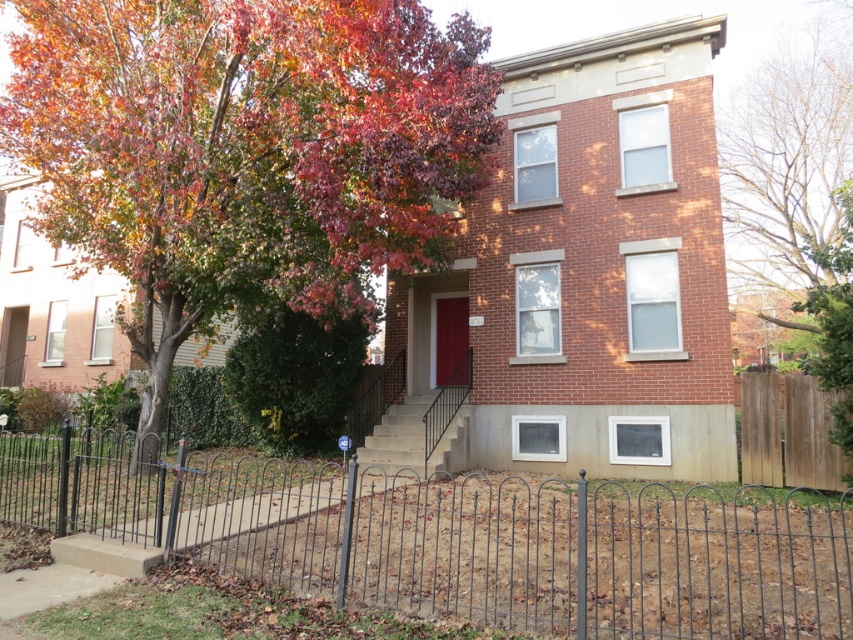
You are standing in front of the house and want to know which of the two points, point (x=381, y=508) or point (x=811, y=240), is closer to you. Which one is closer?

Point (x=381, y=508) is closer to the camera than point (x=811, y=240), so it is closer to you.

You are a gardener who needs to clear autumn leaves at center from the yard. The black wrought iron fence at center is in the way. Can you reach the leaves without moving the fence?

The autumn leaves at center are 16.80 feet away from the black wrought iron fence at center, so yes, you can reach the leaves without moving the fence since they are sufficiently far apart.